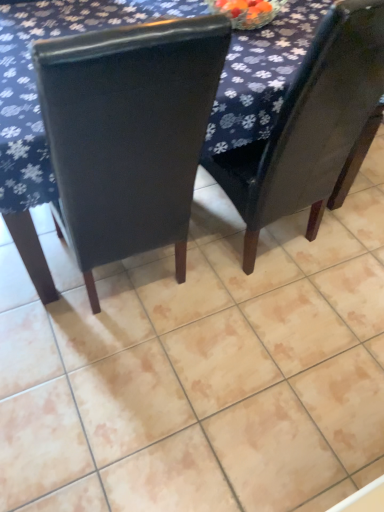
Image resolution: width=384 pixels, height=512 pixels. What are the coordinates of `free space in front of matte black chair at center, which ranks as the second chair in left-to-right order` in the screenshot? It's located at (286, 327).